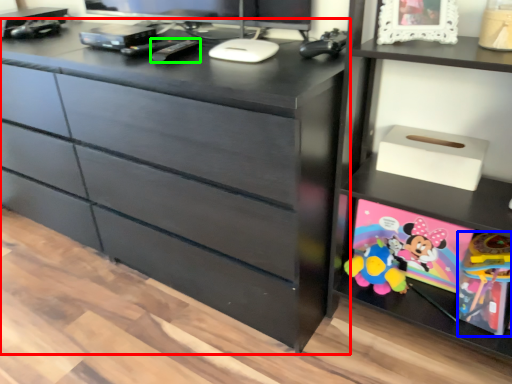
Question: Based on their relative distances, which object is farther from chest of drawers (highlighted by a red box)? Choose from toy (highlighted by a blue box) and remote (highlighted by a green box).

Choices:
 (A) toy
 (B) remote

Answer: (A)